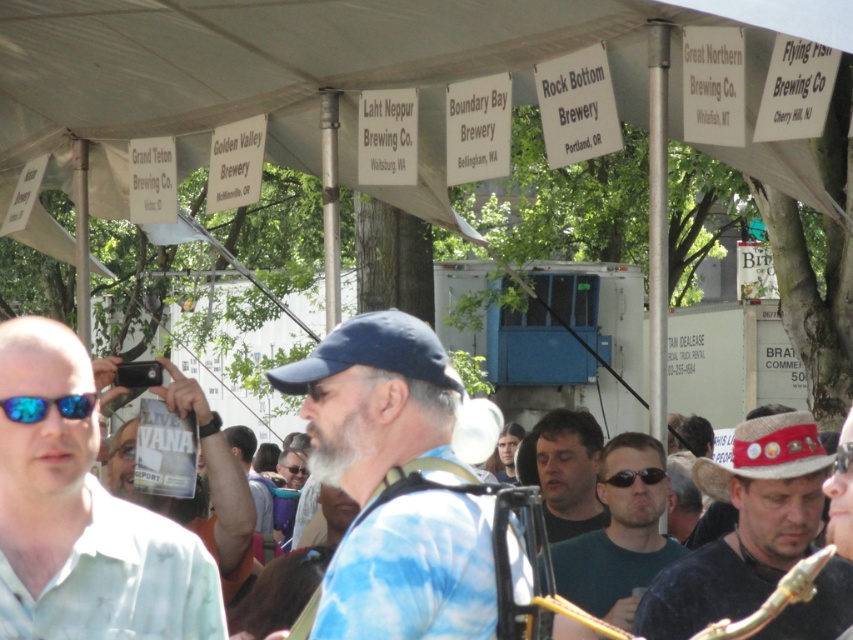
You are a photographer standing at the edge of the crowd. You want to take a photo of the dark green shirt at center and the smooth skin face at center without anyone walking in between them. Is there enough space between them to ensure no one will block the shot?

The distance between the dark green shirt at center and the smooth skin face at center is 19.33 feet, which is a considerable distance. Since the crowd is gathered below the canopy, it is likely that there is enough space between them to avoid obstruction, provided no one moves into that specific area. However, maintaining this space depends on the crowd movement.

You are standing at the center of the event area. You see a dark green shirt at center. Is the dark green shirt at center located exactly at the point with coordinates (566, 472)?

Yes, the dark green shirt at center is located exactly at the point with coordinates (566, 472).